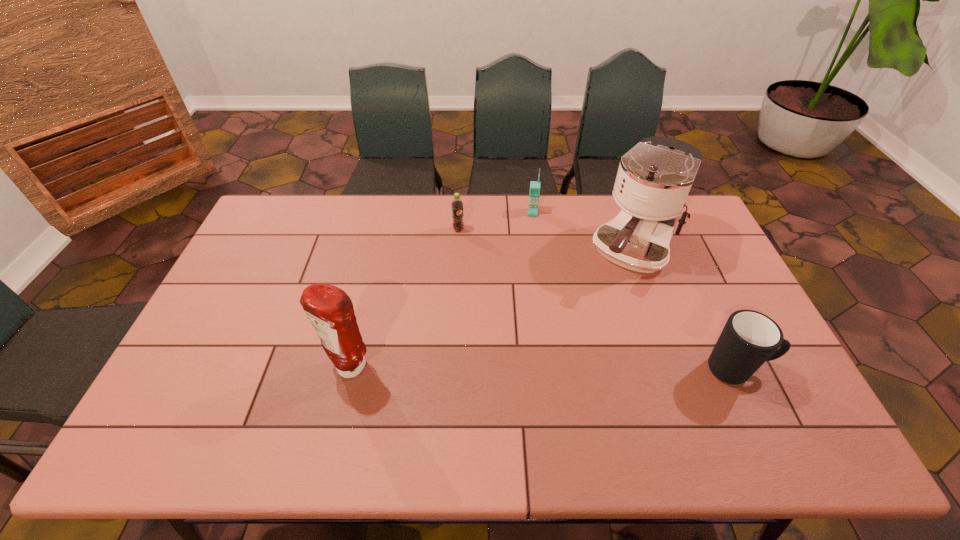
Where is `the fourth shortest object`? This screenshot has height=540, width=960. the fourth shortest object is located at coordinates (330, 310).

Where is `the leftmost object`? This screenshot has height=540, width=960. the leftmost object is located at coordinates (330, 310).

Find the location of a particular element. mug is located at coordinates click(x=749, y=338).

I want to click on coffee maker, so click(654, 178).

What are the coordinates of `soda` in the screenshot? It's located at (457, 205).

Locate an element on the screen. Image resolution: width=960 pixels, height=540 pixels. the fourth object from right to left is located at coordinates (457, 205).

The width and height of the screenshot is (960, 540). I want to click on the farthest object, so click(x=534, y=193).

Find the location of a particular element. The image size is (960, 540). the third object from left to right is located at coordinates (534, 193).

This screenshot has width=960, height=540. I want to click on free point located on the right of the second tallest object, so click(415, 369).

This screenshot has height=540, width=960. Identify the location of vacant space situated 0.100m on the front-facing side of the coffee maker. (604, 305).